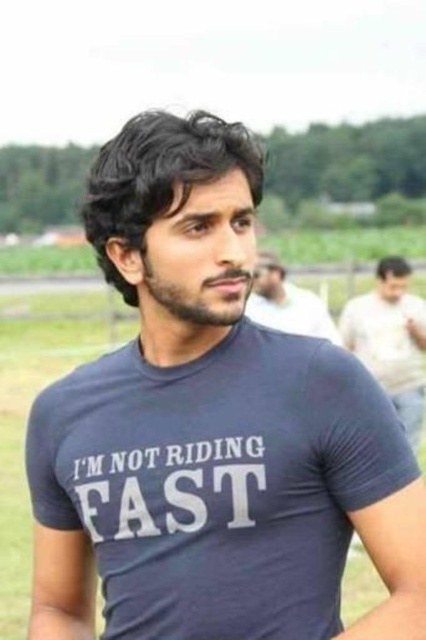
Who is more distant from viewer, (x=425, y=301) or (x=264, y=300)?

Positioned behind is point (x=425, y=301).

Does light beige shirt at right appear under matte blue t-shirt at center?

Indeed, light beige shirt at right is positioned under matte blue t-shirt at center.

Is point (363, 332) in front of point (265, 310)?

No, it is behind (265, 310).

I want to click on light beige shirt at right, so click(x=391, y=339).